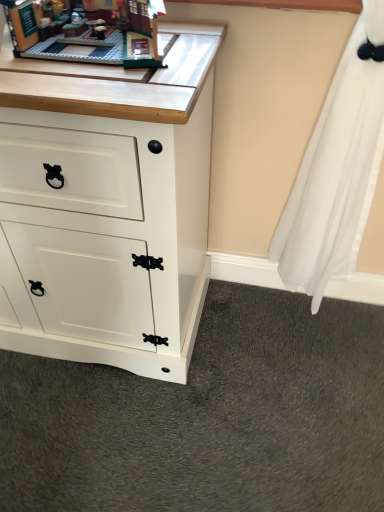
Question: From the image's perspective, is white matte cabinet at center above or below brick-like lego set at upper left?

Choices:
 (A) below
 (B) above

Answer: (A)

Question: Considering their positions, is white matte cabinet at center located in front of or behind brick-like lego set at upper left?

Choices:
 (A) behind
 (B) front

Answer: (B)

Question: Is white matte cabinet at center bigger or smaller than brick-like lego set at upper left?

Choices:
 (A) small
 (B) big

Answer: (B)

Question: Would you say brick-like lego set at upper left is inside or outside white matte cabinet at center?

Choices:
 (A) inside
 (B) outside

Answer: (B)

Question: In terms of height, does brick-like lego set at upper left look taller or shorter compared to white matte cabinet at center?

Choices:
 (A) tall
 (B) short

Answer: (B)

Question: In terms of width, does brick-like lego set at upper left look wider or thinner when compared to white matte cabinet at center?

Choices:
 (A) thin
 (B) wide

Answer: (A)

Question: Is point (29, 51) positioned closer to the camera than point (190, 82)?

Choices:
 (A) farther
 (B) closer

Answer: (A)